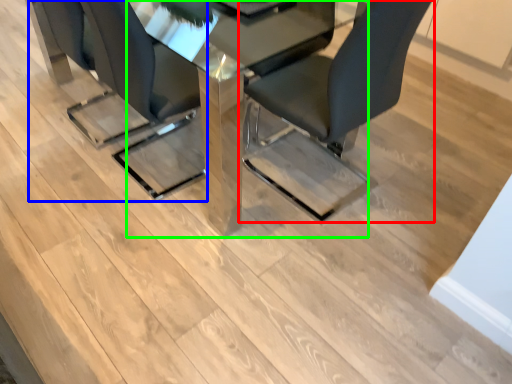
Question: Which object is positioned closest to chair (highlighted by a red box)? Select from chair (highlighted by a blue box) and table (highlighted by a green box).

Choices:
 (A) chair
 (B) table

Answer: (B)